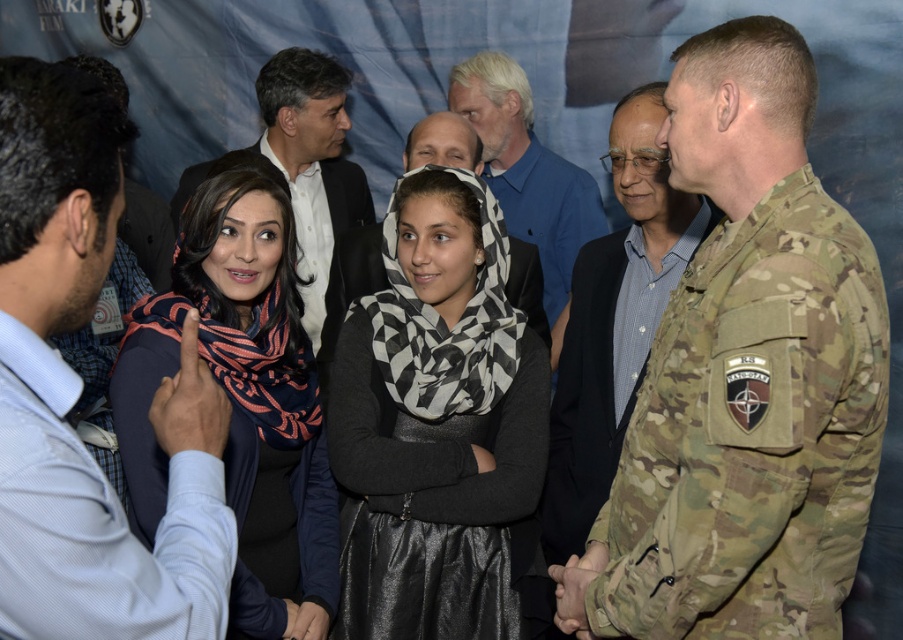
You are standing in the room and want to give a gift to the person wearing the light blue shirt at left and the person wearing the black and white checkered scarf at center. Which person should you approach first if you want to start with the one closer to your current position?

The light blue shirt at left is to the left of black and white checkered scarf at center, so you should approach the light blue shirt at left first since it is closer to your current position.

You are a photographer at this event and need to capture a group photo that includes both the white shirt at center and the light blue shirt at center. The camera you are using has a maximum focus range of 25 inches. Can you fit both subjects within the camera focus range without moving either of them?

The distance between the white shirt at center and the light blue shirt at center is 28.23 inches, which exceeds the camera focus range of 25 inches. Therefore, you cannot fit both subjects within the camera focus range without moving them.